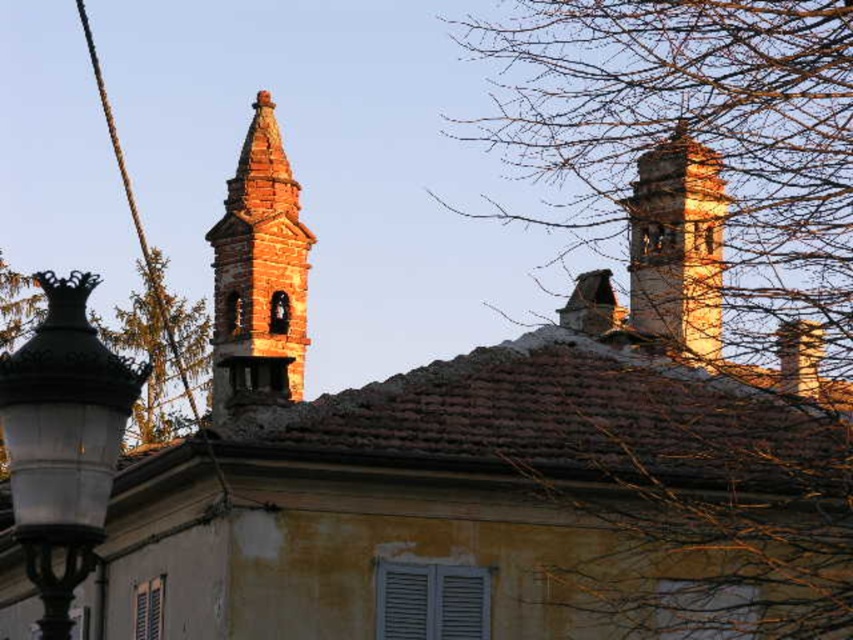
Is black wrought iron lamp post at left above green leafy tree at upper left?

No, black wrought iron lamp post at left is not above green leafy tree at upper left.

Does black wrought iron lamp post at left appear under green leafy tree at upper left?

Yes.

Between point (26, 515) and point (186, 320), which one is positioned behind?

The point (186, 320) is more distant.

You are a GUI agent. You are given a task and a screenshot of the screen. Output one action in this format:
    pyautogui.click(x=<x>, y=<y>)
    Task: Click on the black wrought iron lamp post at left
    Image resolution: width=853 pixels, height=640 pixels.
    Given the screenshot: What is the action you would take?
    pyautogui.click(x=62, y=442)

You are a GUI agent. You are given a task and a screenshot of the screen. Output one action in this format:
    pyautogui.click(x=<x>, y=<y>)
    Task: Click on the rustic stone bell tower at upper left
    The width and height of the screenshot is (853, 640).
    Given the screenshot: What is the action you would take?
    pyautogui.click(x=259, y=273)

Is rustic stone bell tower at upper left further to camera compared to brown stone tower at upper right?

That is True.

You are a GUI agent. You are given a task and a screenshot of the screen. Output one action in this format:
    pyautogui.click(x=<x>, y=<y>)
    Task: Click on the rustic stone bell tower at upper left
    The image size is (853, 640).
    Given the screenshot: What is the action you would take?
    pyautogui.click(x=259, y=273)

Find the location of a particular element. rustic stone bell tower at upper left is located at coordinates (259, 273).

Can you confirm if bare branches at upper center is shorter than green leafy tree at upper left?

No.

Is bare branches at upper center behind green leafy tree at upper left?

No, it is in front of green leafy tree at upper left.

Between point (628, 45) and point (138, 292), which one is positioned behind?

Point (138, 292)

Identify the location of bare branches at upper center. The height and width of the screenshot is (640, 853). (695, 157).